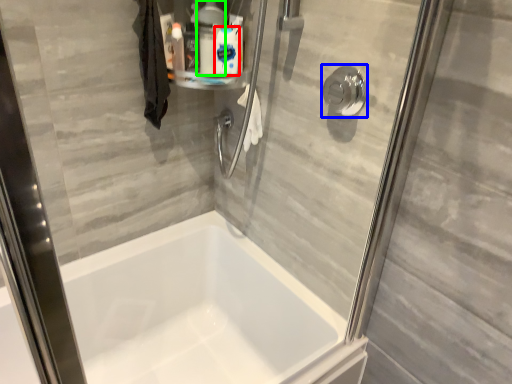
Question: Which object is the farthest from cleaning product (highlighted by a red box)? Choose among these: shower (highlighted by a blue box) or cleaning product (highlighted by a green box).

Choices:
 (A) shower
 (B) cleaning product

Answer: (A)